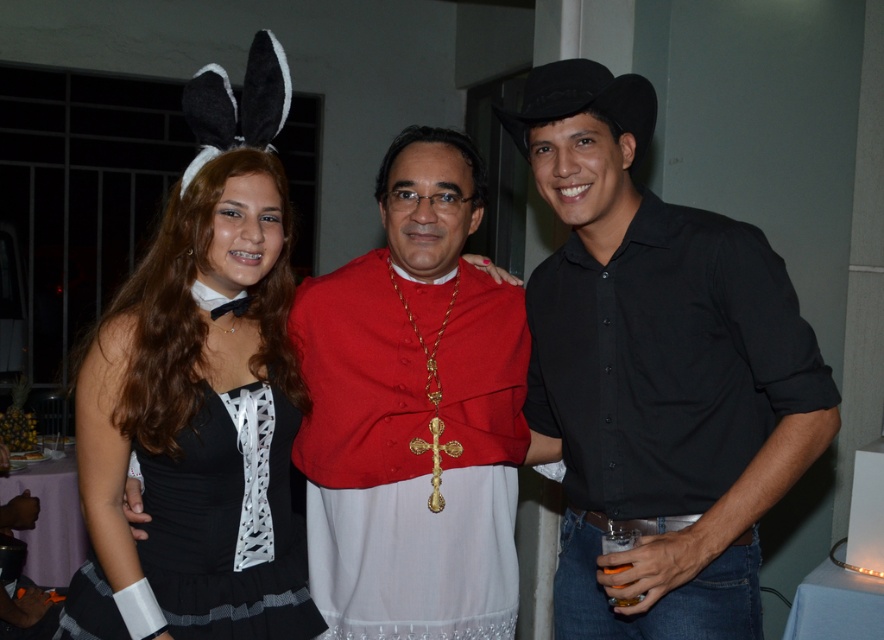
Question: From the image, what is the correct spatial relationship of red velvet cape at center in relation to black satin dress at center?

Choices:
 (A) above
 (B) below

Answer: (A)

Question: Which of the following is the farthest from the observer?

Choices:
 (A) red velvet cape at center
 (B) black cotton shirt at center

Answer: (A)

Question: Which object is farther from the camera taking this photo?

Choices:
 (A) red velvet cape at center
 (B) black cotton shirt at center
 (C) black satin dress at center

Answer: (A)

Question: Observing the image, what is the correct spatial positioning of black cotton shirt at center in reference to black satin dress at center?

Choices:
 (A) above
 (B) below

Answer: (A)

Question: Considering the real-world distances, which object is closest to the black satin dress at center?

Choices:
 (A) red velvet cape at center
 (B) black cotton shirt at center

Answer: (A)

Question: Is red velvet cape at center thinner than black satin dress at center?

Choices:
 (A) no
 (B) yes

Answer: (A)